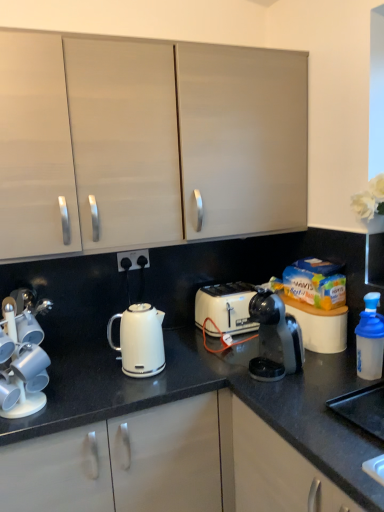
Image resolution: width=384 pixels, height=512 pixels. Identify the location of free spot in front of white glossy kettle at center. (125, 395).